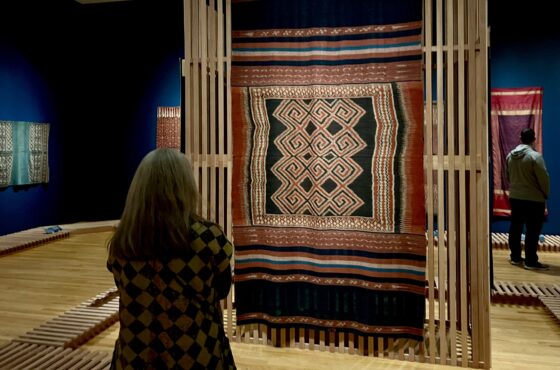
I want to click on woven artwork, so coord(415,165), coord(512,113), coord(172,127), coord(42,151).